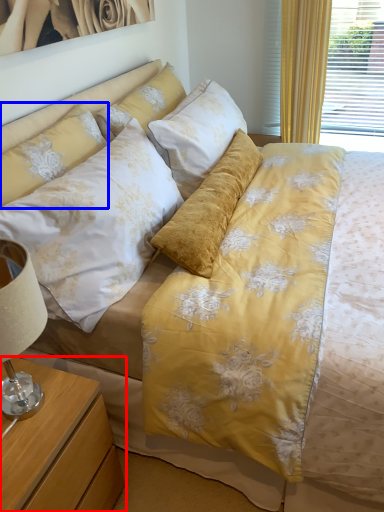
Question: Which object appears closest to the camera in this image, nightstand (highlighted by a red box) or pillow (highlighted by a blue box)?

Choices:
 (A) nightstand
 (B) pillow

Answer: (A)